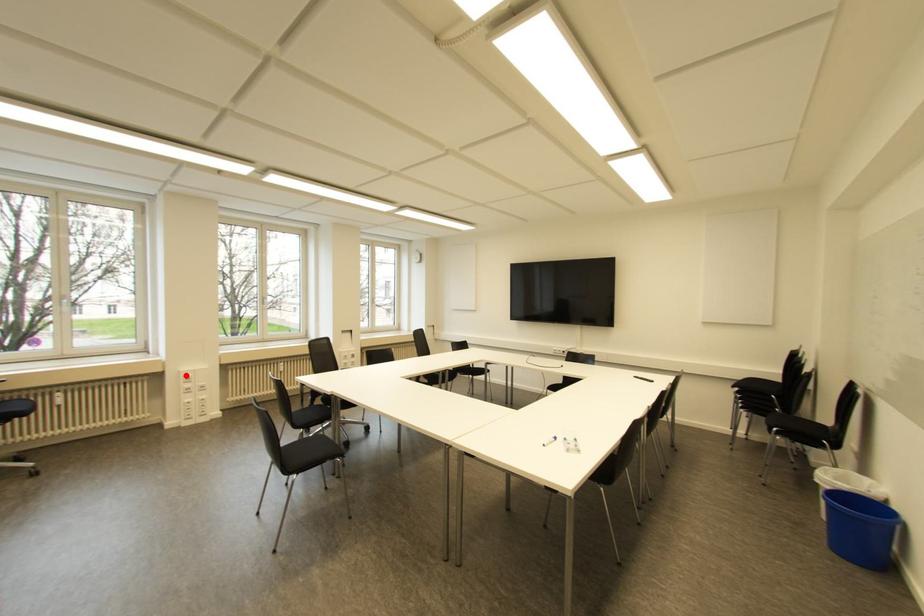
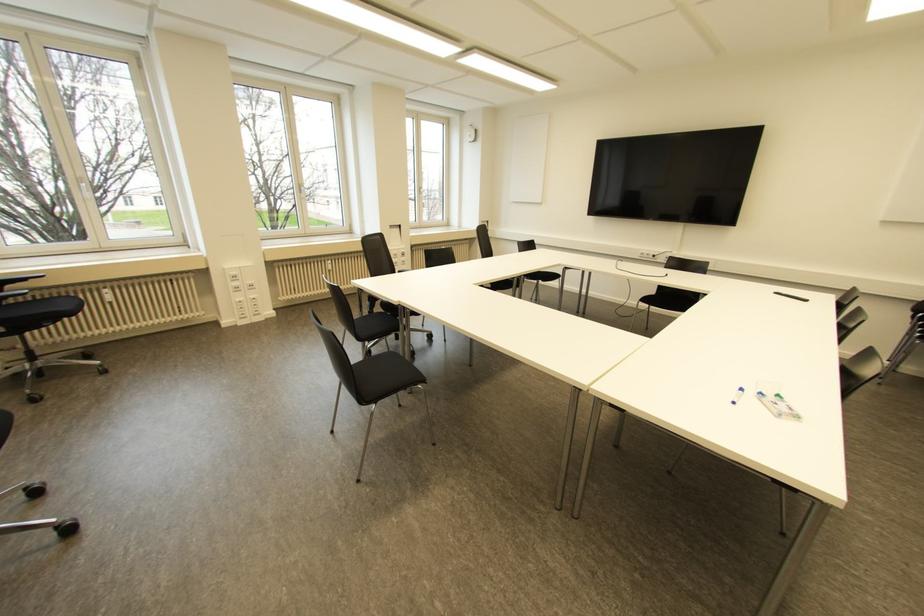
Question: A red point is marked in image1. In image2, is the corresponding 3D point closer to the camera or farther? Reply with the corresponding letter.

Choices:
 (A) The corresponding 3D point is closer.
 (B) The corresponding 3D point is farther.

Answer: (A)